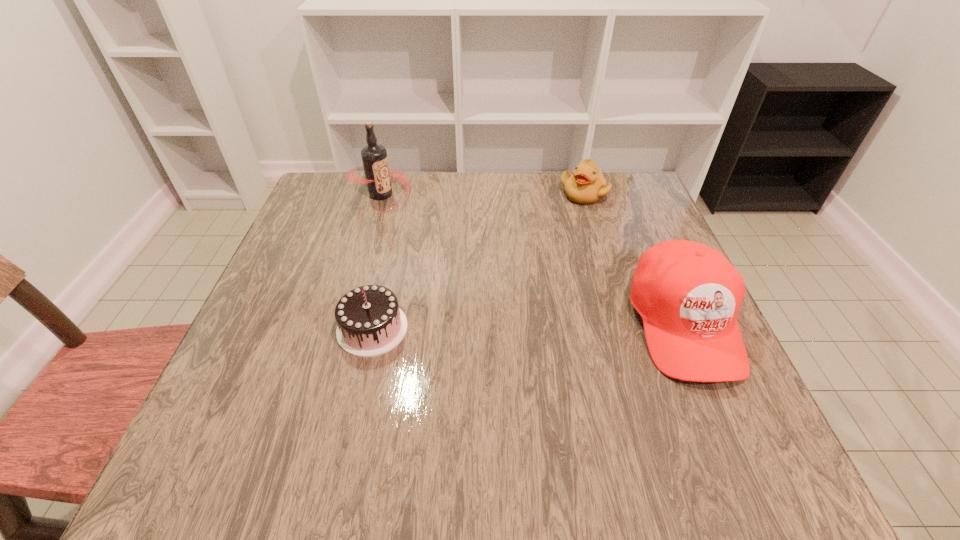
What are the coordinates of `free space that is in between the second tallest object and the chocolate cake` in the screenshot? It's located at (528, 326).

Locate an element on the screen. Image resolution: width=960 pixels, height=540 pixels. free space between the duckling and the tallest object is located at coordinates (482, 194).

Locate an element on the screen. This screenshot has width=960, height=540. empty space that is in between the baseball cap and the chocolate cake is located at coordinates (528, 326).

Identify the location of vacant point located between the third shortest object and the duckling. This screenshot has width=960, height=540. (634, 259).

At what (x,y) coordinates should I click in order to perform the action: click on empty space that is in between the chocolate cake and the duckling. Please return your answer as a coordinate pair (x, y). Image resolution: width=960 pixels, height=540 pixels. Looking at the image, I should click on (478, 261).

At what (x,y) coordinates should I click in order to perform the action: click on free space between the chocolate cake and the baseball cap. Please return your answer as a coordinate pair (x, y). Looking at the image, I should click on (528, 326).

The image size is (960, 540). I want to click on object that ranks as the second closest to the duckling, so click(374, 157).

The image size is (960, 540). Identify the location of object that is the second closest to the chocolate cake. (688, 294).

Locate an element on the screen. The height and width of the screenshot is (540, 960). vacant space that satisfies the following two spatial constraints: 1. on the front side of the chocolate cake; 2. on the left side of the tallest object is located at coordinates (342, 328).

Where is `vacant region that satisfies the following two spatial constraints: 1. on the back side of the root beer; 2. on the left side of the duckling`? The height and width of the screenshot is (540, 960). vacant region that satisfies the following two spatial constraints: 1. on the back side of the root beer; 2. on the left side of the duckling is located at coordinates (381, 193).